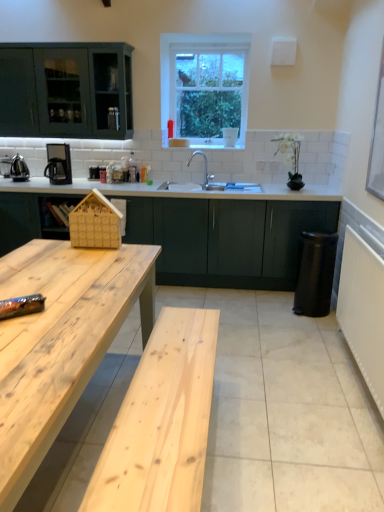
Question: Is matte black coffee machine at left to the left or to the right of natural wood table at lower left in the image?

Choices:
 (A) left
 (B) right

Answer: (A)

Question: Looking at their shapes, would you say matte black coffee machine at left is wider or thinner than natural wood table at lower left?

Choices:
 (A) wide
 (B) thin

Answer: (B)

Question: Estimate the real-world distances between objects in this image. Which object is closer to the wooden house at center?

Choices:
 (A) white ceramic sink at center
 (B) clear glass window at upper center
 (C) white textured radiator at right
 (D) dark green matte cabinet at center
 (E) polished stainless steel kettle at left

Answer: (D)

Question: Estimate the real-world distances between objects in this image. Which object is closer to the wooden house at center?

Choices:
 (A) white textured radiator at right
 (B) clear glass window at upper center
 (C) matte black coffee machine at left
 (D) dark green matte cabinet at center
 (E) white ceramic sink at center

Answer: (D)